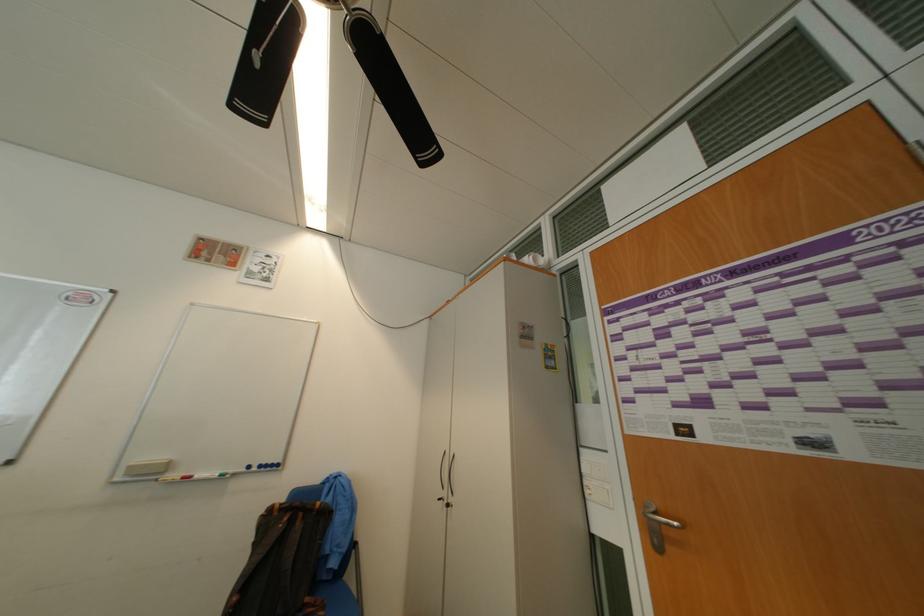
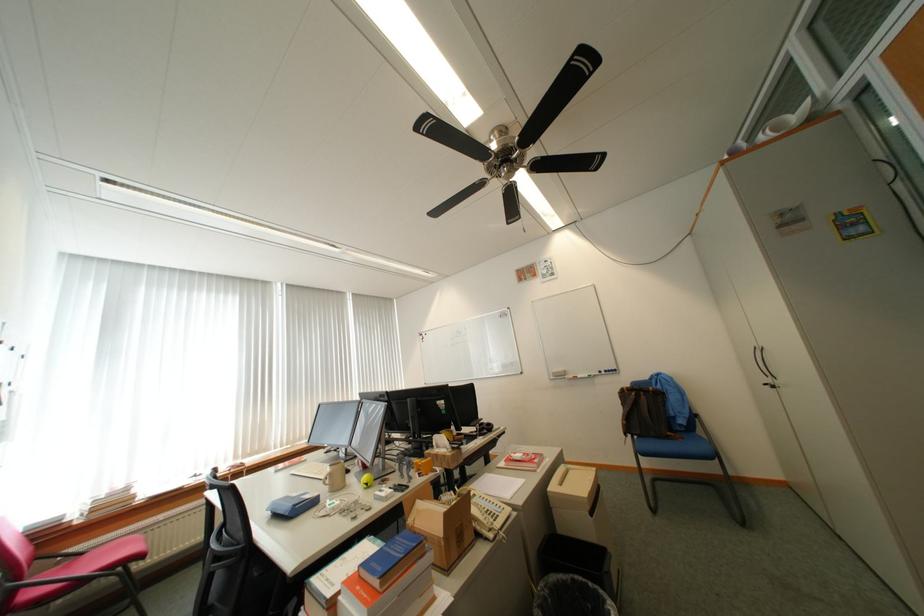
The point at (359, 576) is marked in the first image. Where is the corresponding point in the second image?

(709, 432)